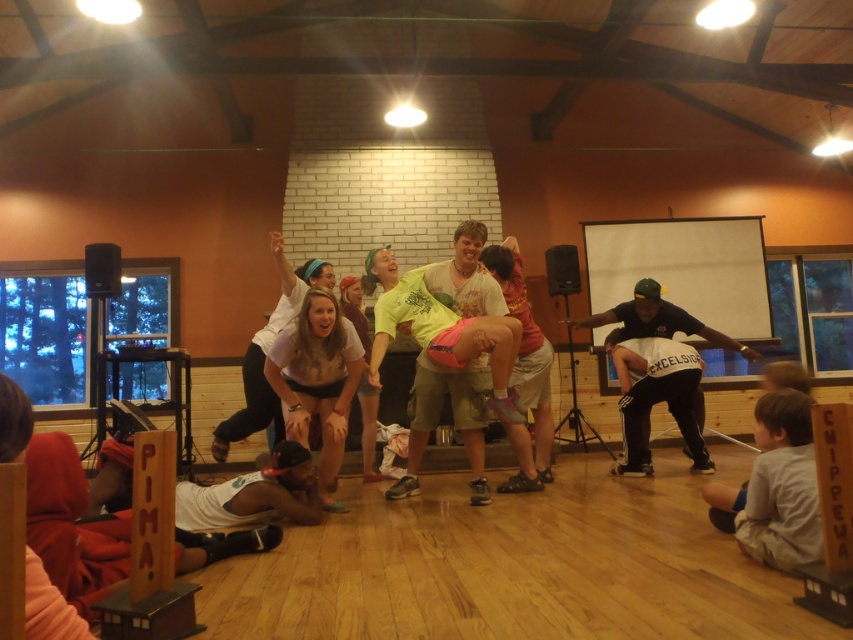
Looking at this image, you are a photographer setting up for an event. You need to position a light source to illuminate both the gray cotton shirt at lower right and the white matte shorts at center. Given their positions, where should you place the light source to ensure both are well lit?

The gray cotton shirt at lower right is below the white matte shorts at center. To illuminate both effectively, position the light source above the white matte shorts at center so it can cast light downward onto both objects.

You are organizing a sports event and need to ensure participants have the correct attire. You notice two participants wearing white matte shorts at center and black athletic pants at right. Which participant is wearing the smaller lower garment?

The white matte shorts at center is smaller than the black athletic pants at right, so the participant wearing the white matte shorts at center has the smaller lower garment.

You are a photographer positioned at the entrance of the room. You want to capture a photo that includes both the gray cotton shirt at lower right and the black athletic pants at right. Which object should you adjust your camera angle to focus on first to ensure both are in frame?

The gray cotton shirt at lower right is closer to the viewer than the black athletic pants at right, so you should focus on the gray cotton shirt at lower right first to ensure both are in frame.